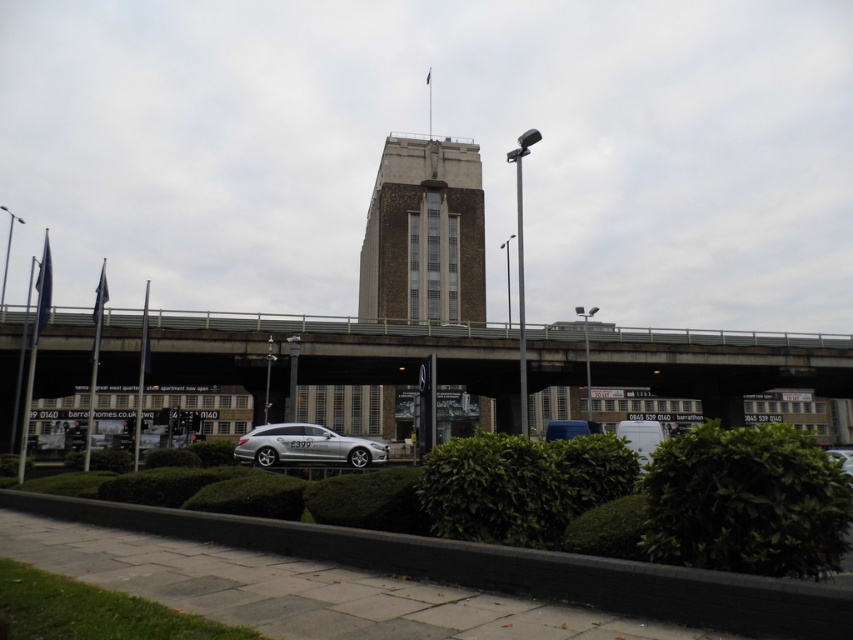
Is concrete bridge at center wider than silver metallic car at lower right?

Yes.

What do you see at coordinates (331, 355) in the screenshot? Image resolution: width=853 pixels, height=640 pixels. I see `concrete bridge at center` at bounding box center [331, 355].

You are a GUI agent. You are given a task and a screenshot of the screen. Output one action in this format:
    pyautogui.click(x=<x>, y=<y>)
    Task: Click on the concrete bridge at center
    The image size is (853, 640).
    Given the screenshot: What is the action you would take?
    click(331, 355)

Is green hedge at center bigger than silver metallic car at lower right?

No, green hedge at center is not bigger than silver metallic car at lower right.

Is green hedge at center wider than silver metallic car at lower right?

In fact, green hedge at center might be narrower than silver metallic car at lower right.

Image resolution: width=853 pixels, height=640 pixels. What do you see at coordinates (502, 566) in the screenshot? I see `green hedge at center` at bounding box center [502, 566].

Find the location of `green hedge at center`. green hedge at center is located at coordinates (502, 566).

Measure the distance between metallic silver car at center and silver metallic car at lower right.

metallic silver car at center and silver metallic car at lower right are 65.65 feet apart from each other.

Which is more to the right, metallic silver car at center or silver metallic car at lower right?

Positioned to the right is metallic silver car at center.

Describe the element at coordinates (570, 428) in the screenshot. I see `metallic silver car at center` at that location.

You are a GUI agent. You are given a task and a screenshot of the screen. Output one action in this format:
    pyautogui.click(x=<x>, y=<y>)
    Task: Click on the metallic silver car at center
    
    Given the screenshot: What is the action you would take?
    pyautogui.click(x=570, y=428)